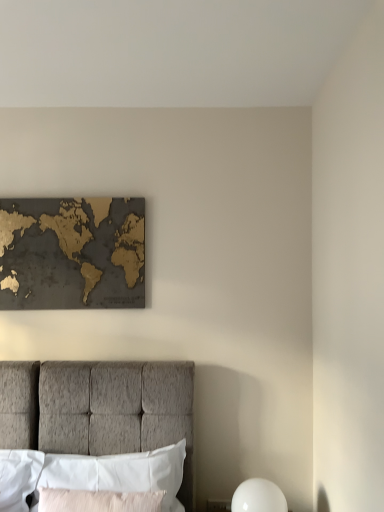
This screenshot has height=512, width=384. Find the location of `free space above gold metallic map at upper center (from a real-world perspective)`. free space above gold metallic map at upper center (from a real-world perspective) is located at coordinates (69, 195).